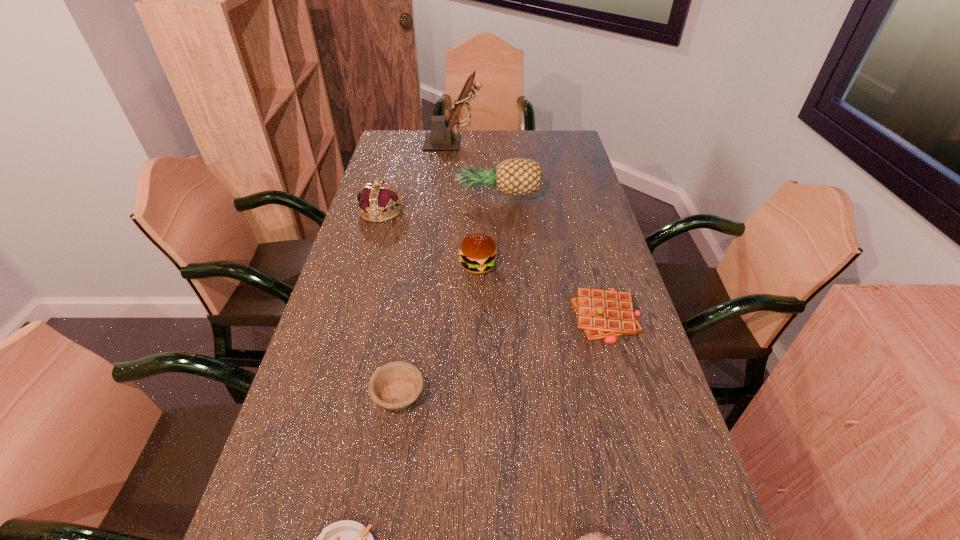
Identify the location of free spot located on the left of the pineapple. (393, 197).

Identify the location of vacant space situated 0.210m on the right of the crown. The image size is (960, 540). (467, 211).

This screenshot has width=960, height=540. Find the location of `vacant space located on the left of the fifth nearest object`. vacant space located on the left of the fifth nearest object is located at coordinates click(x=421, y=266).

Find the location of a particular element. The height and width of the screenshot is (540, 960). free space located 0.280m on the back of the waffle is located at coordinates (583, 231).

Locate an element on the screen. Image resolution: width=960 pixels, height=540 pixels. free space located on the right of the sixth farthest object is located at coordinates click(474, 394).

The width and height of the screenshot is (960, 540). What are the coordinates of `object at the far edge` in the screenshot? It's located at (441, 138).

Find the location of a particular element. This screenshot has height=540, width=960. object that is at the left edge is located at coordinates (379, 201).

What are the coordinates of `object that is at the right edge` in the screenshot? It's located at (603, 314).

Locate an element on the screen. This screenshot has width=960, height=540. vacant space at the far edge of the desktop is located at coordinates (466, 143).

I want to click on free region at the left edge of the desktop, so click(393, 165).